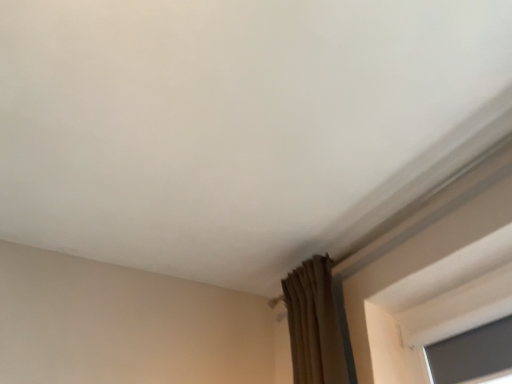
This screenshot has height=384, width=512. What do you see at coordinates (472, 353) in the screenshot? I see `gray matte window at lower right` at bounding box center [472, 353].

Where is `gray matte window at lower right`? gray matte window at lower right is located at coordinates (472, 353).

Measure the distance between point (461, 343) and camera.

Point (461, 343) and camera are 4.81 feet apart.

The height and width of the screenshot is (384, 512). Find the location of `gray matte window at lower right`. gray matte window at lower right is located at coordinates (472, 353).